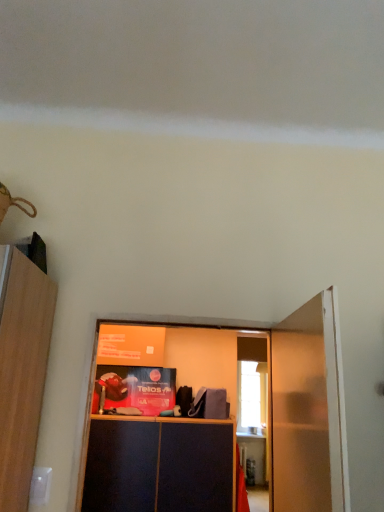
Question: From the image's perspective, is white glossy door at right under dark wood cabinet at center?

Choices:
 (A) no
 (B) yes

Answer: (A)

Question: Is white glossy door at right not within dark wood cabinet at center?

Choices:
 (A) yes
 (B) no

Answer: (A)

Question: Considering the relative sizes of white glossy door at right and dark wood cabinet at center in the image provided, is white glossy door at right taller than dark wood cabinet at center?

Choices:
 (A) yes
 (B) no

Answer: (A)

Question: Is white glossy door at right bigger than dark wood cabinet at center?

Choices:
 (A) no
 (B) yes

Answer: (A)

Question: From a real-world perspective, is white glossy door at right on dark wood cabinet at center?

Choices:
 (A) yes
 (B) no

Answer: (A)

Question: Considering the relative sizes of white glossy door at right and dark wood cabinet at center in the image provided, is white glossy door at right shorter than dark wood cabinet at center?

Choices:
 (A) no
 (B) yes

Answer: (A)

Question: Is dark wood cabinet at center wider than white glossy door at right?

Choices:
 (A) no
 (B) yes

Answer: (B)

Question: From the image's perspective, does dark wood cabinet at center appear higher than white glossy door at right?

Choices:
 (A) no
 (B) yes

Answer: (A)

Question: Can you confirm if dark wood cabinet at center is taller than white glossy door at right?

Choices:
 (A) yes
 (B) no

Answer: (B)

Question: Is dark wood cabinet at center to the right of white glossy door at right from the viewer's perspective?

Choices:
 (A) yes
 (B) no

Answer: (B)

Question: Can you confirm if dark wood cabinet at center is smaller than white glossy door at right?

Choices:
 (A) no
 (B) yes

Answer: (A)

Question: Can you confirm if dark wood cabinet at center is thinner than white glossy door at right?

Choices:
 (A) yes
 (B) no

Answer: (B)

Question: Does point (288, 442) appear closer or farther from the camera than point (125, 459)?

Choices:
 (A) closer
 (B) farther

Answer: (A)